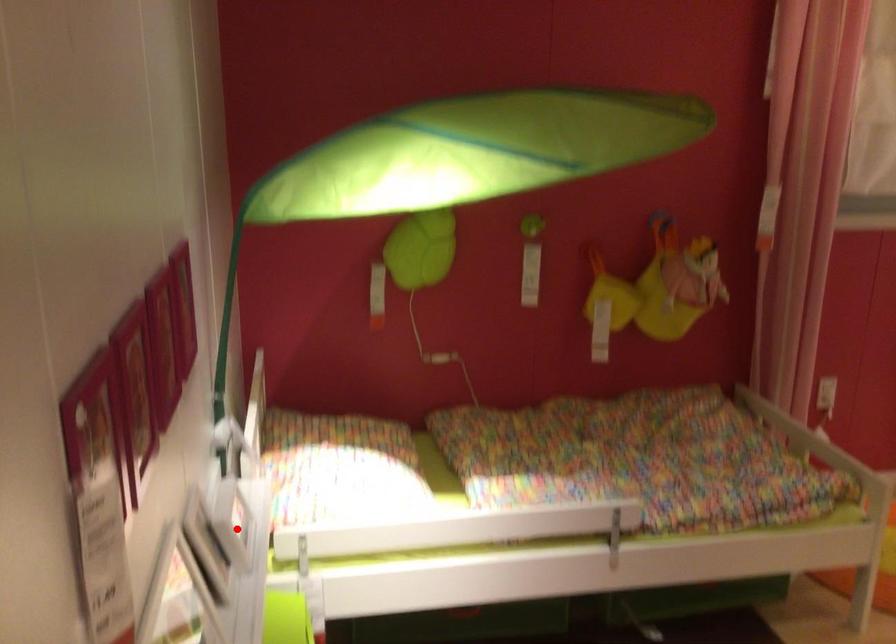
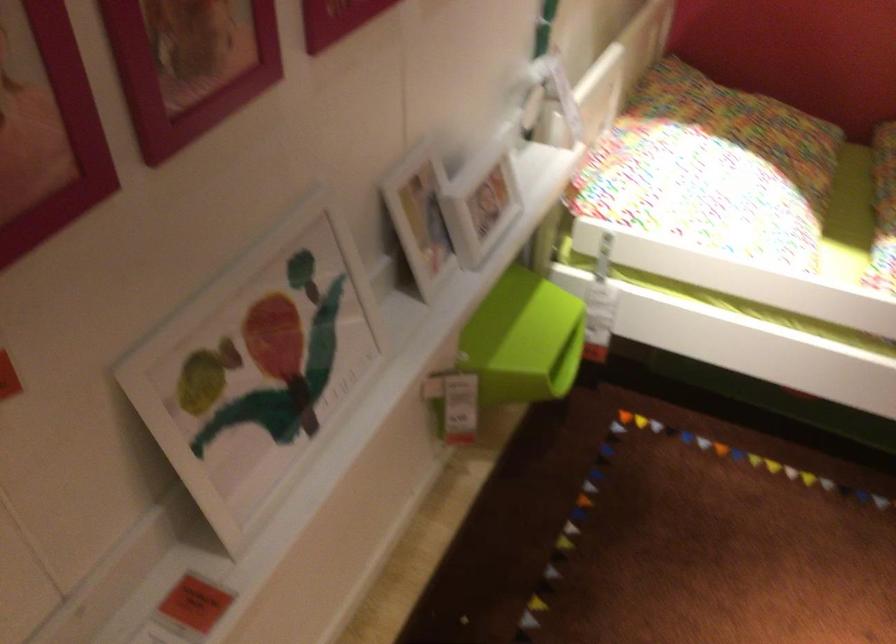
Question: I am providing you with two images of the same scene from different viewpoints. In image1, a red point is highlighted. Considering the same 3D point in image2, which of the following is correct?

Choices:
 (A) It is closer
 (B) It is farther

Answer: (A)